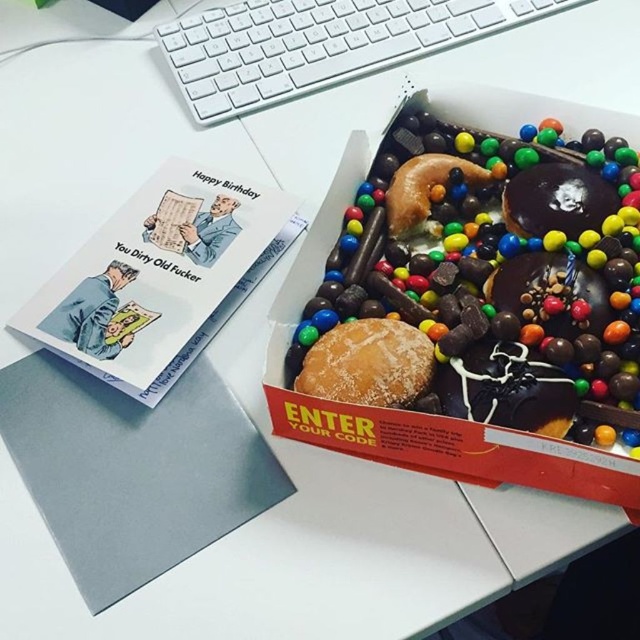
Please provide the coordinates of the powdered sugar bun at center in the image. The coordinates should be in the format of a point with two decimal places, like point (369, 364). The scene is on a white desk with a box of donuts decorated with MMs and chocolate pieces. The box has a red color and the text

The powdered sugar bun at center is located at point (369, 364).